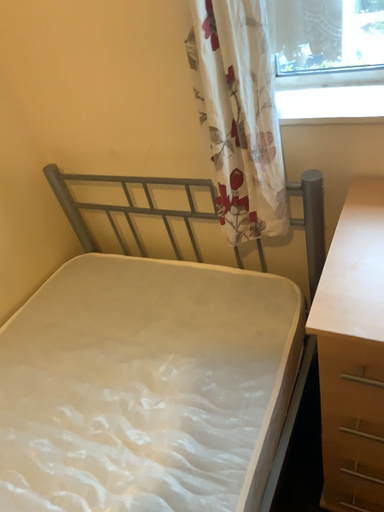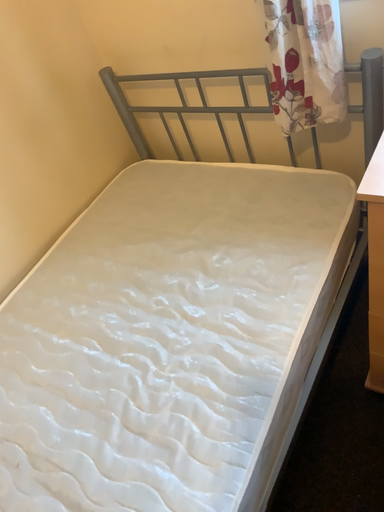
Question: How did the camera likely rotate when shooting the video?

Choices:
 (A) rotated upward
 (B) rotated downward

Answer: (B)